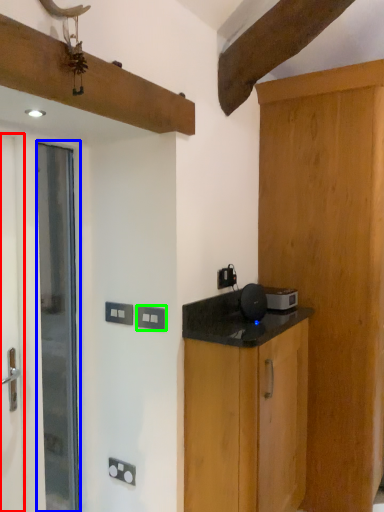
Question: Which is farther away from screen door (highlighted by a red box)? door (highlighted by a blue box) or electric outlet (highlighted by a green box)?

Choices:
 (A) door
 (B) electric outlet

Answer: (B)